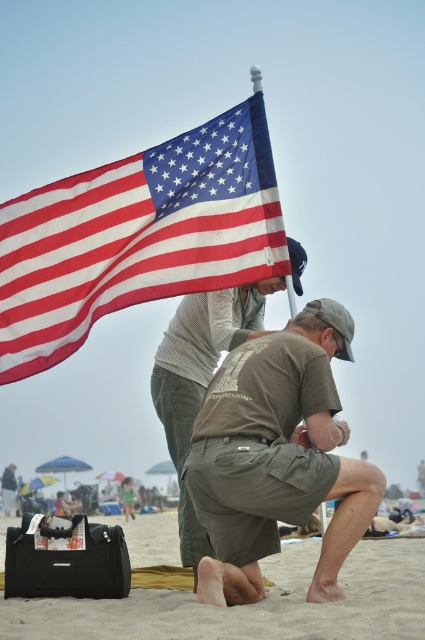
Question: Is sandy beige sand at lower center to the left of brown cotton t-shirt at center from the viewer's perspective?

Choices:
 (A) no
 (B) yes

Answer: (B)

Question: Does american flag at upper left appear over khaki cotton shorts at center?

Choices:
 (A) yes
 (B) no

Answer: (A)

Question: Among these objects, which one is nearest to the camera?

Choices:
 (A) brown cotton t-shirt at center
 (B) khaki cotton shorts at center
 (C) sandy beige sand at lower center

Answer: (C)

Question: Which point appears farthest from the camera in this image?

Choices:
 (A) (238, 339)
 (B) (127, 253)
 (C) (384, 612)
 (D) (258, 376)

Answer: (B)

Question: Which of these objects is positioned farthest from the brown cotton t-shirt at center?

Choices:
 (A) sandy beige sand at lower center
 (B) khaki cotton shorts at center
 (C) american flag at upper left

Answer: (A)

Question: Can you confirm if american flag at upper left is smaller than brown cotton t-shirt at center?

Choices:
 (A) yes
 (B) no

Answer: (A)